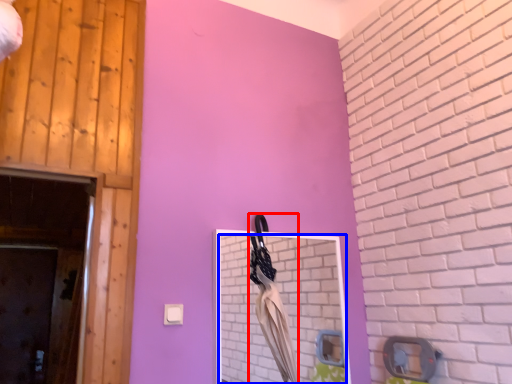
Question: Which point is closer to the camera, laundry (highlighted by a red box) or mirror (highlighted by a blue box)?

Choices:
 (A) laundry
 (B) mirror

Answer: (B)